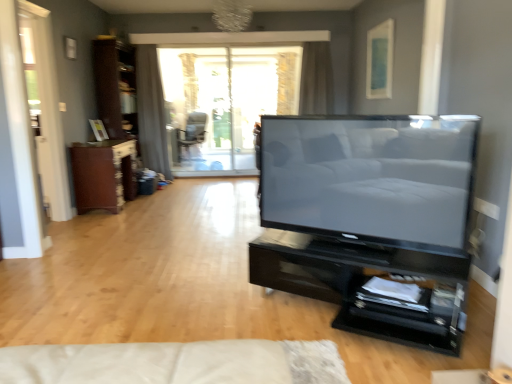
Question: Can you confirm if satin gray curtain at upper center, the first curtain positioned from the right, is wider than white glossy screen door at left?

Choices:
 (A) yes
 (B) no

Answer: (A)

Question: Is satin gray curtain at upper center, the first curtain positioned from the right, far away from white glossy screen door at left?

Choices:
 (A) no
 (B) yes

Answer: (B)

Question: Is satin gray curtain at upper center, the first curtain positioned from the right, surrounding white glossy screen door at left?

Choices:
 (A) no
 (B) yes

Answer: (A)

Question: From a real-world perspective, is satin gray curtain at upper center, the first curtain positioned from the right, beneath white glossy screen door at left?

Choices:
 (A) yes
 (B) no

Answer: (B)

Question: From the image's perspective, does satin gray curtain at upper center, the first curtain positioned from the right, appear lower than white glossy screen door at left?

Choices:
 (A) no
 (B) yes

Answer: (A)

Question: Is white glossy screen door at left at the back of satin gray curtain at upper center, placed as the second curtain when sorted from left to right?

Choices:
 (A) yes
 (B) no

Answer: (B)

Question: Are matte blue picture frame at upper right, the second picture frame positioned from the left, and gray fabric curtain at upper center, the first curtain when ordered from left to right, beside each other?

Choices:
 (A) no
 (B) yes

Answer: (A)

Question: Is matte blue picture frame at upper right, the 2th picture frame when ordered from bottom to top, located outside gray fabric curtain at upper center, the first curtain when ordered from left to right?

Choices:
 (A) yes
 (B) no

Answer: (A)

Question: Is matte blue picture frame at upper right, the first picture frame from the top, bigger than gray fabric curtain at upper center, the first curtain when ordered from left to right?

Choices:
 (A) no
 (B) yes

Answer: (A)

Question: Is matte blue picture frame at upper right, the first picture frame from the top, surrounding gray fabric curtain at upper center, the first curtain when ordered from left to right?

Choices:
 (A) no
 (B) yes

Answer: (A)

Question: Considering the relative sizes of matte blue picture frame at upper right, the second picture frame positioned from the left, and gray fabric curtain at upper center, the first curtain when ordered from left to right, in the image provided, is matte blue picture frame at upper right, the second picture frame positioned from the left, wider than gray fabric curtain at upper center, the first curtain when ordered from left to right,?

Choices:
 (A) yes
 (B) no

Answer: (B)

Question: Does matte blue picture frame at upper right, acting as the first picture frame starting from the right, have a greater height compared to gray fabric curtain at upper center, the first curtain when ordered from left to right?

Choices:
 (A) no
 (B) yes

Answer: (A)

Question: Considering the relative sizes of white glossy screen door at left and matte black chair at center in the image provided, is white glossy screen door at left thinner than matte black chair at center?

Choices:
 (A) no
 (B) yes

Answer: (B)